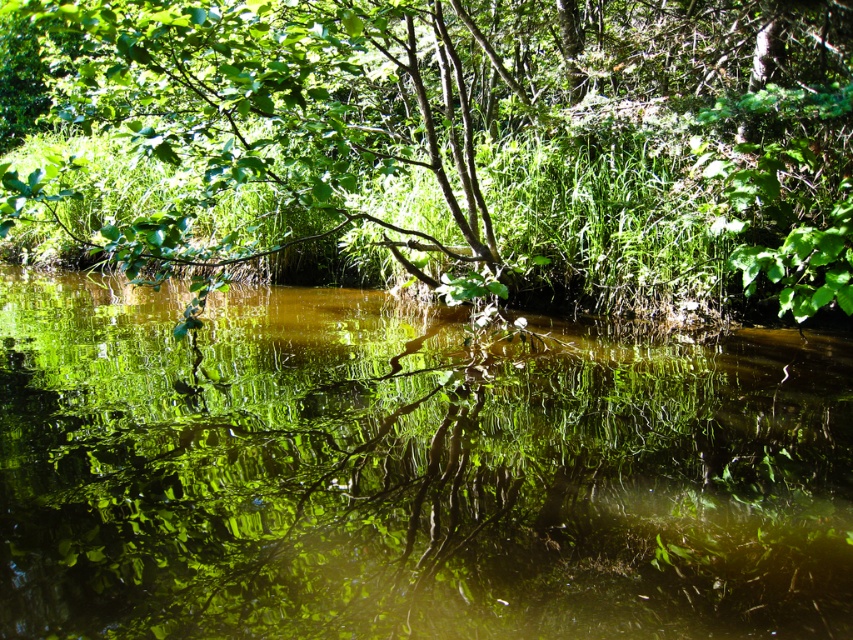
You are standing at the edge of the water and want to take a photo of the green leafy tree at center and the green reflective water at center. Which object will appear closer to you in the photo?

The green reflective water at center will appear closer to you in the photo because it is in front of the green leafy tree at center.

You are standing on the edge of the water and want to take a photo of both the green reflective water at center and the green leafy tree at center. Which object should you position to your left to include both in the frame?

You should position the green leafy tree at center to your left because the green reflective water at center is to the right of it, so placing the tree on your left will allow both to be captured in the photo.

You are standing at the edge of the scene and want to take a photo that includes both the green reflective water at center and the green leafy tree at center. Which object should you focus on first to ensure both are in frame?

You should focus on the green leafy tree at center first because it occupies more space than the green reflective water at center, so adjusting the frame to include the larger object ensures the smaller one also fits.